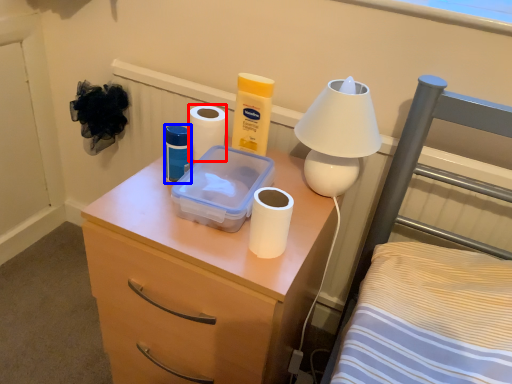
Question: Which point is further to the camera, toilet paper (highlighted by a red box) or toiletry (highlighted by a blue box)?

Choices:
 (A) toilet paper
 (B) toiletry

Answer: (A)